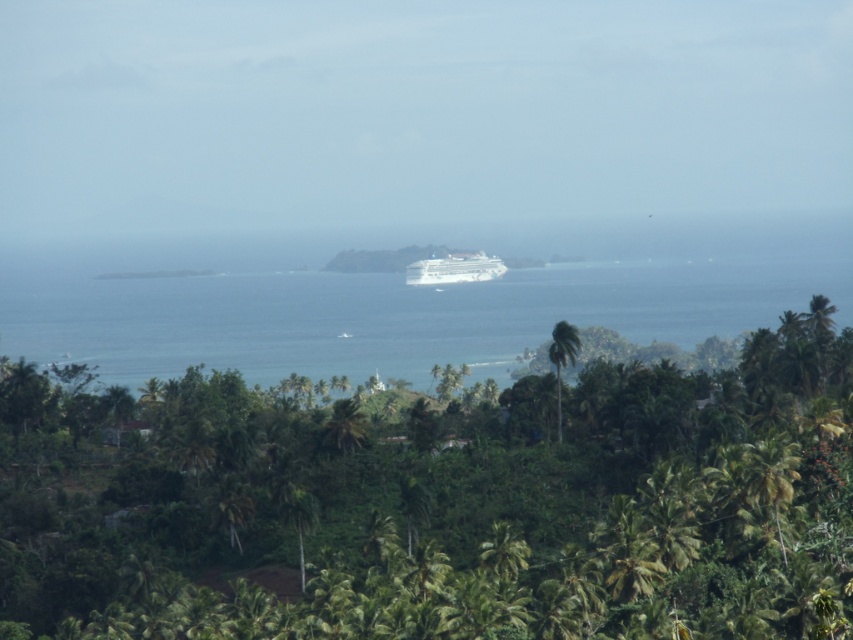
Does green leafy tree at center have a greater width compared to blue water at center?

In fact, green leafy tree at center might be narrower than blue water at center.

Does green leafy tree at center appear over blue water at center?

No.

Describe the element at coordinates (439, 502) in the screenshot. I see `green leafy tree at center` at that location.

Image resolution: width=853 pixels, height=640 pixels. I want to click on green leafy tree at center, so pyautogui.click(x=439, y=502).

The image size is (853, 640). In order to click on blue water at center in this screenshot , I will do `click(396, 308)`.

Looking at this image, does blue water at center have a lesser height compared to green leafy palm tree at center?

No.

The image size is (853, 640). What do you see at coordinates (396, 308) in the screenshot? I see `blue water at center` at bounding box center [396, 308].

Where is `blue water at center`? This screenshot has width=853, height=640. blue water at center is located at coordinates (396, 308).

Can you confirm if white glossy cruise ship at center is positioned above green leafy palm tree at center?

Yes.

Does white glossy cruise ship at center appear under green leafy palm tree at center?

Actually, white glossy cruise ship at center is above green leafy palm tree at center.

Does point (476, 260) come farther from viewer compared to point (573, 339)?

Yes, it is behind point (573, 339).

This screenshot has height=640, width=853. I want to click on white glossy cruise ship at center, so click(454, 268).